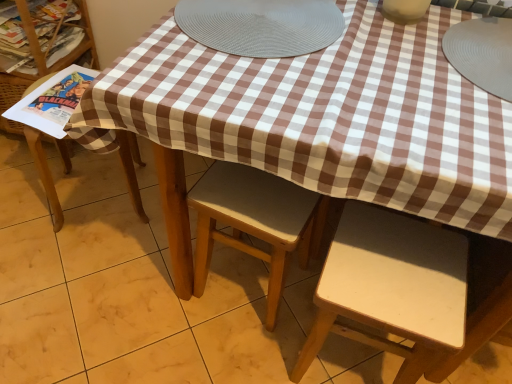
Question: Considering the relative positions of matte white vase at upper center, the 1th tableware viewed from the left, and matte paper magazine at left in the image provided, is matte white vase at upper center, the 1th tableware viewed from the left, in front of matte paper magazine at left?

Choices:
 (A) no
 (B) yes

Answer: (B)

Question: Is matte white vase at upper center, the 1th tableware viewed from the left, thinner than matte paper magazine at left?

Choices:
 (A) yes
 (B) no

Answer: (A)

Question: Considering the relative sizes of matte white vase at upper center, the 1th tableware viewed from the left, and matte paper magazine at left in the image provided, is matte white vase at upper center, the 1th tableware viewed from the left, shorter than matte paper magazine at left?

Choices:
 (A) yes
 (B) no

Answer: (B)

Question: Is matte white vase at upper center, the 1th tableware viewed from the left, taller than matte paper magazine at left?

Choices:
 (A) no
 (B) yes

Answer: (B)

Question: From a real-world perspective, is matte white vase at upper center, which is the 2th tableware from right to left, below matte paper magazine at left?

Choices:
 (A) yes
 (B) no

Answer: (B)

Question: Could you tell me if matte white vase at upper center, which is the 2th tableware from right to left, is facing matte paper magazine at left?

Choices:
 (A) no
 (B) yes

Answer: (A)

Question: Is matte paper magazine at left surrounding gray rubber placemat at upper right, the 1th tableware viewed from the right?

Choices:
 (A) no
 (B) yes

Answer: (A)

Question: Considering the relative sizes of matte paper magazine at left and gray rubber placemat at upper right, the second tableware positioned from the left, in the image provided, is matte paper magazine at left shorter than gray rubber placemat at upper right, the second tableware positioned from the left,?

Choices:
 (A) no
 (B) yes

Answer: (A)

Question: Are matte paper magazine at left and gray rubber placemat at upper right, the second tableware positioned from the left, far apart?

Choices:
 (A) yes
 (B) no

Answer: (A)

Question: From a real-world perspective, is matte paper magazine at left located beneath gray rubber placemat at upper right, the 1th tableware viewed from the right?

Choices:
 (A) yes
 (B) no

Answer: (A)

Question: Considering the relative sizes of matte paper magazine at left and gray rubber placemat at upper right, the 1th tableware viewed from the right, in the image provided, is matte paper magazine at left bigger than gray rubber placemat at upper right, the 1th tableware viewed from the right,?

Choices:
 (A) no
 (B) yes

Answer: (A)

Question: Can you confirm if matte paper magazine at left is positioned to the left of gray rubber placemat at upper right, the 1th tableware viewed from the right?

Choices:
 (A) yes
 (B) no

Answer: (A)

Question: Considering the relative sizes of light brown wood chair at center, which appears as the second chair when viewed from the left, and matte white vase at upper center, which is the 2th tableware from right to left, in the image provided, is light brown wood chair at center, which appears as the second chair when viewed from the left, smaller than matte white vase at upper center, which is the 2th tableware from right to left,?

Choices:
 (A) yes
 (B) no

Answer: (B)